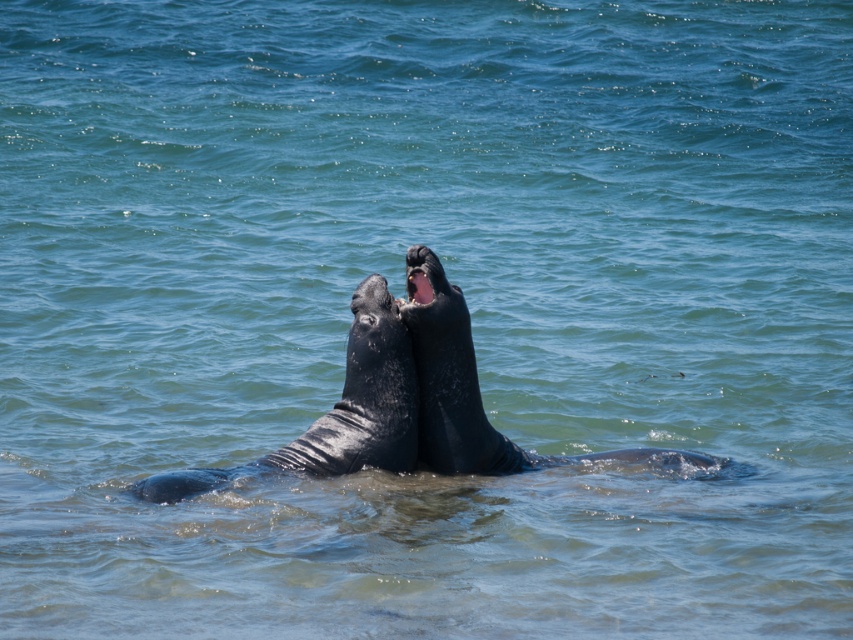
Question: Does shiny black whale at center have a smaller size compared to smooth dark gray whale at center?

Choices:
 (A) yes
 (B) no

Answer: (A)

Question: Which of the following is the closest to the observer?

Choices:
 (A) smooth dark gray whale at center
 (B) shiny black whale at center

Answer: (A)

Question: Is shiny black whale at center above smooth dark gray whale at center?

Choices:
 (A) no
 (B) yes

Answer: (A)

Question: Which point is closer to the camera taking this photo?

Choices:
 (A) (469, 468)
 (B) (381, 412)

Answer: (B)

Question: Does shiny black whale at center lie behind smooth dark gray whale at center?

Choices:
 (A) no
 (B) yes

Answer: (B)